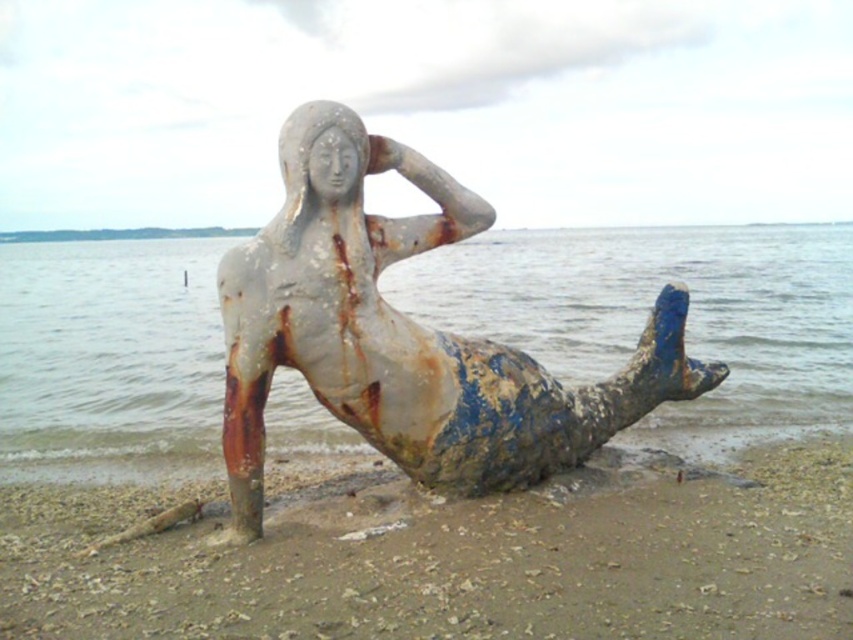
Does rusty metallic water at center have a lesser width compared to rusty metal mermaid at center?

Incorrect, rusty metallic water at center's width is not less than rusty metal mermaid at center's.

Can you confirm if rusty metallic water at center is smaller than rusty metal mermaid at center?

No, rusty metallic water at center is not smaller than rusty metal mermaid at center.

Locate an element on the screen. rusty metallic water at center is located at coordinates (647, 310).

You are a GUI agent. You are given a task and a screenshot of the screen. Output one action in this format:
    pyautogui.click(x=<x>, y=<y>)
    Task: Click on the rusty metallic water at center
    Image resolution: width=853 pixels, height=640 pixels.
    Given the screenshot: What is the action you would take?
    pyautogui.click(x=647, y=310)

Can you confirm if rusty metallic sand at lower center is smaller than rusty metal mermaid at center?

Indeed, rusty metallic sand at lower center has a smaller size compared to rusty metal mermaid at center.

Who is taller, rusty metallic sand at lower center or rusty metal mermaid at center?

Standing taller between the two is rusty metal mermaid at center.

Is point (358, 541) closer to viewer compared to point (669, 333)?

Yes, it is in front of point (669, 333).

The height and width of the screenshot is (640, 853). In order to click on rusty metallic sand at lower center in this screenshot , I will do `click(450, 557)`.

Who is shorter, rusty metallic sand at lower center or rusty metallic water at center?

rusty metallic sand at lower center

Does rusty metallic sand at lower center appear over rusty metallic water at center?

Actually, rusty metallic sand at lower center is below rusty metallic water at center.

What do you see at coordinates (450, 557) in the screenshot? I see `rusty metallic sand at lower center` at bounding box center [450, 557].

Identify the location of rusty metallic sand at lower center. This screenshot has height=640, width=853. (450, 557).